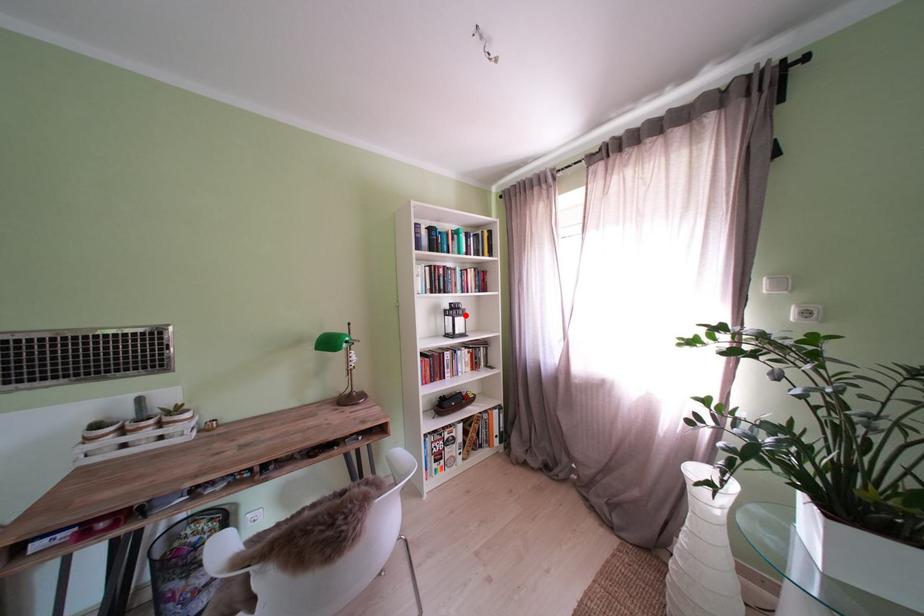
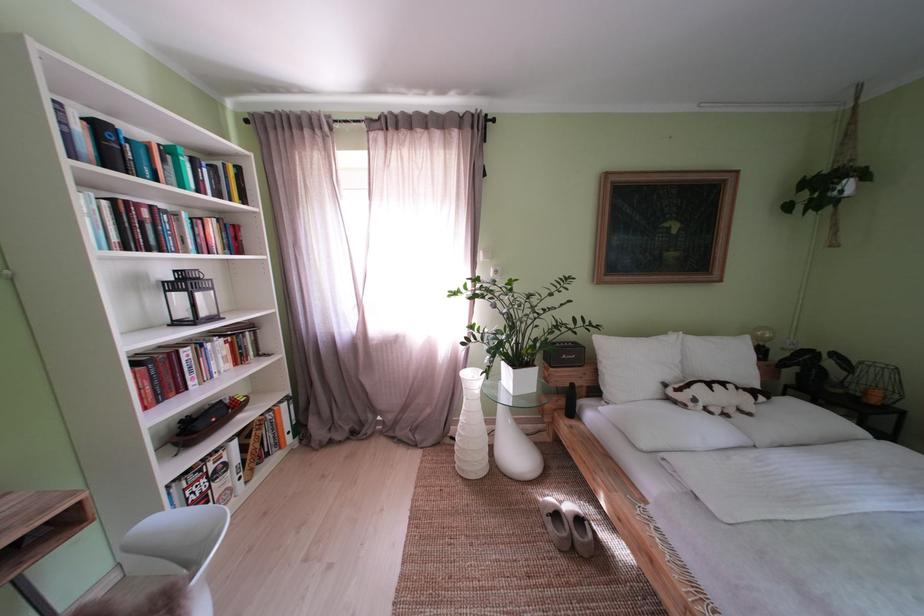
Find the pixel in the second image that matches the highlighted location in the first image.

(198, 286)